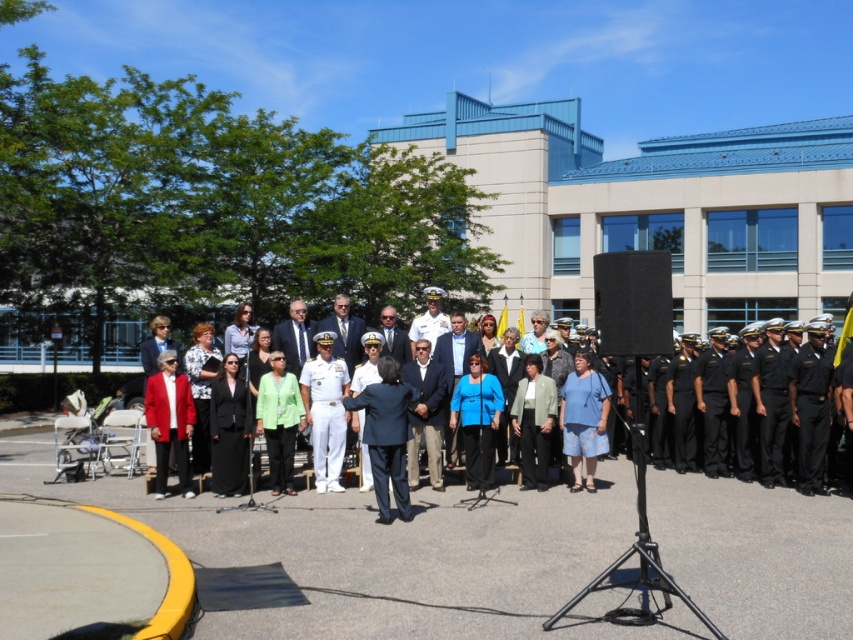
Question: Considering the real-world distances, which object is farthest from the matte red blazer at left?

Choices:
 (A) green matte jacket at center
 (B) dark blue suit at center
 (C) matte black suit at center

Answer: (C)

Question: Which is farther from the dark blue suit at center?

Choices:
 (A) matte black suit at center
 (B) green matte jacket at center

Answer: (A)

Question: Among these objects, which one is farthest from the camera?

Choices:
 (A) matte black suit at center
 (B) matte red blazer at left

Answer: (B)

Question: Can you confirm if dark blue suit at center is positioned to the left of matte red blazer at left?

Choices:
 (A) no
 (B) yes

Answer: (A)

Question: Does dark blue suit at center appear on the left side of matte red blazer at left?

Choices:
 (A) no
 (B) yes

Answer: (A)

Question: Does matte red blazer at left have a smaller size compared to green matte jacket at center?

Choices:
 (A) yes
 (B) no

Answer: (A)